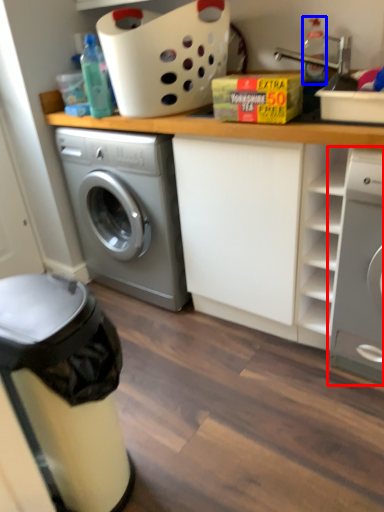
Question: Among these objects, which one is farthest to the camera, washing machine (highlighted by a red box) or bottle (highlighted by a blue box)?

Choices:
 (A) washing machine
 (B) bottle

Answer: (B)